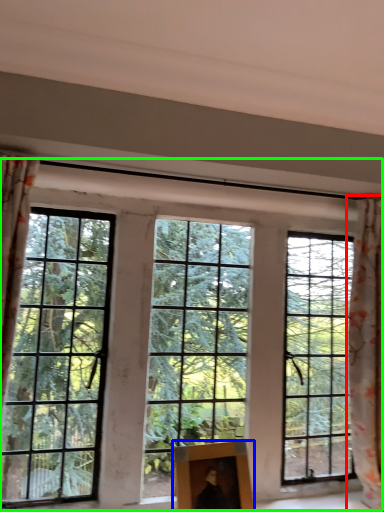
Question: Which object is positioned closest to curtain (highlighted by a red box)? Select from picture frame (highlighted by a blue box) and window (highlighted by a green box).

Choices:
 (A) picture frame
 (B) window

Answer: (B)